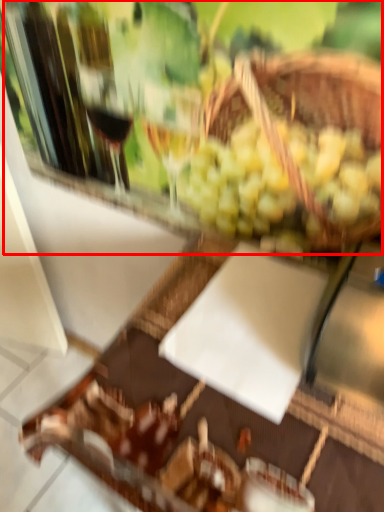
Question: From the image's perspective, considering the relative positions of wine tasting (annotated by the red box) and table in the image provided, where is wine tasting (annotated by the red box) located with respect to the staircase?

Choices:
 (A) above
 (B) below

Answer: (A)